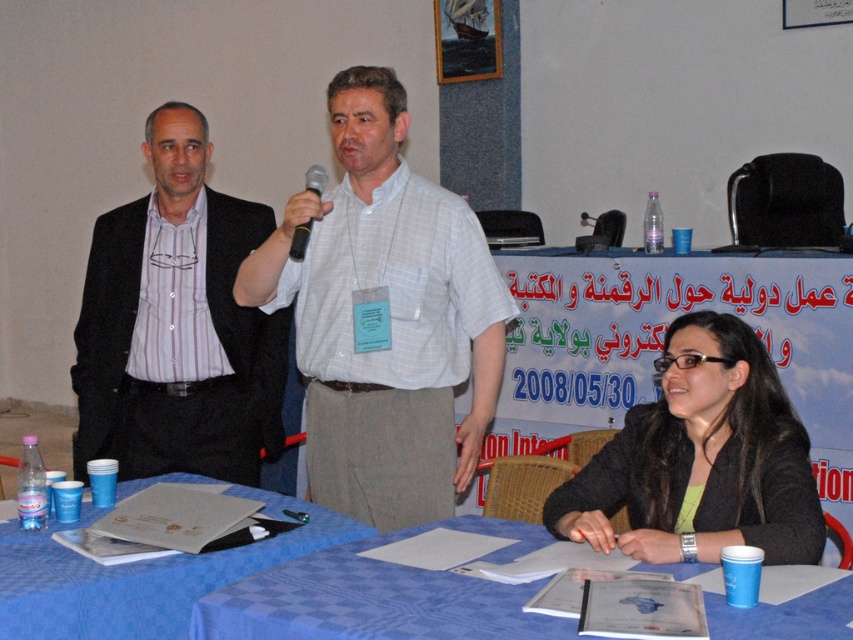
Is the position of light gray striped shirt at center more distant than that of black plastic microphone at center?

Yes.

Measure the distance between point (479, 276) and camera.

Point (479, 276) is 8.71 feet from camera.

Where is `light gray striped shirt at center`? The width and height of the screenshot is (853, 640). light gray striped shirt at center is located at coordinates (386, 317).

Looking at this image, does blue fabric table at lower center have a smaller size compared to black plastic microphone at center?

No.

Is blue fabric table at lower center above black plastic microphone at center?

No.

Between point (318, 584) and point (306, 186), which one is positioned behind?

The point (306, 186) is more distant.

This screenshot has height=640, width=853. I want to click on blue fabric table at lower center, so click(x=380, y=596).

Is light gray striped shirt at center positioned at the back of black glossy jacket at lower right?

Yes, it is.

Can you confirm if light gray striped shirt at center is shorter than black glossy jacket at lower right?

No.

The image size is (853, 640). What do you see at coordinates (386, 317) in the screenshot?
I see `light gray striped shirt at center` at bounding box center [386, 317].

Where is `light gray striped shirt at center`? The width and height of the screenshot is (853, 640). light gray striped shirt at center is located at coordinates (386, 317).